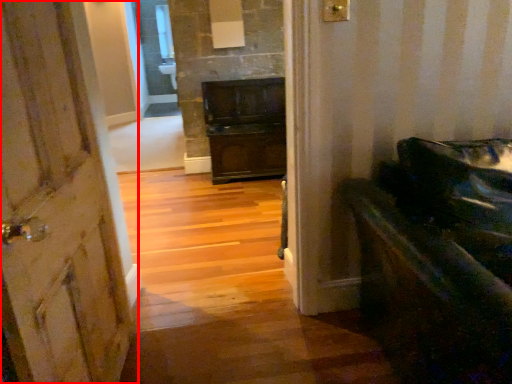
Question: In this image, where is door (annotated by the red box) located relative to furniture?

Choices:
 (A) right
 (B) left

Answer: (B)